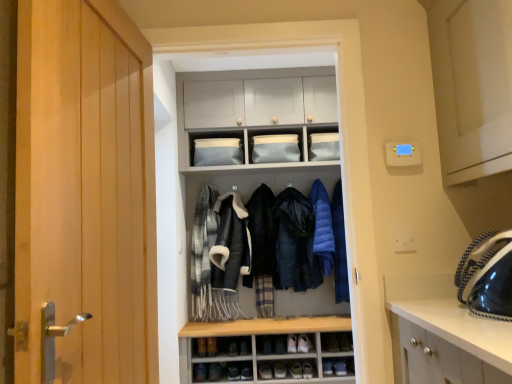
Question: Which direction should I rotate to face fluffy black jacket at center, which ranks as the fourth clothing in right-to-left order, — up or down?

Choices:
 (A) down
 (B) up

Answer: (A)

Question: Does matte blue fabric at upper center, the third cabinet when ordered from right to left, have a lesser height compared to blue down jacket at center, the 5th clothing when ordered from left to right?

Choices:
 (A) yes
 (B) no

Answer: (A)

Question: Does matte blue fabric at upper center, the 1th cabinet in the left-to-right sequence, touch blue down jacket at center, the 1th clothing from the right?

Choices:
 (A) no
 (B) yes

Answer: (A)

Question: Is matte blue fabric at upper center, the third cabinet when ordered from right to left, outside of blue down jacket at center, the 1th clothing from the right?

Choices:
 (A) yes
 (B) no

Answer: (A)

Question: Is matte blue fabric at upper center, the third cabinet when ordered from right to left, facing towards blue down jacket at center, the 1th clothing from the right?

Choices:
 (A) yes
 (B) no

Answer: (B)

Question: Would you consider matte blue fabric at upper center, the 1th cabinet in the left-to-right sequence, to be distant from blue down jacket at center, the 5th clothing when ordered from left to right?

Choices:
 (A) no
 (B) yes

Answer: (B)

Question: Is matte blue fabric at upper center, the third cabinet when ordered from right to left, surrounding blue down jacket at center, the 1th clothing from the right?

Choices:
 (A) no
 (B) yes

Answer: (A)

Question: Is white leather shoe at lower center, positioned as the 2th shoe in left-to-right order, at the left side of wooden door at left?

Choices:
 (A) yes
 (B) no

Answer: (B)

Question: Is white leather shoe at lower center, acting as the 3th shoe starting from the top, not close to wooden door at left?

Choices:
 (A) no
 (B) yes

Answer: (B)

Question: Is white leather shoe at lower center, acting as the 3th shoe starting from the top, positioned in front of wooden door at left?

Choices:
 (A) yes
 (B) no

Answer: (B)

Question: Considering the relative sizes of white leather shoe at lower center, which is counted as the 1th shoe, starting from the bottom, and wooden door at left in the image provided, is white leather shoe at lower center, which is counted as the 1th shoe, starting from the bottom, bigger than wooden door at left?

Choices:
 (A) no
 (B) yes

Answer: (A)

Question: Is wooden door at left surrounded by white leather shoe at lower center, positioned as the 2th shoe in left-to-right order?

Choices:
 (A) no
 (B) yes

Answer: (A)

Question: From the image's perspective, is white leather shoe at lower center, positioned as the 2th shoe in left-to-right order, located above wooden door at left?

Choices:
 (A) no
 (B) yes

Answer: (A)

Question: Is plaid wool scarf at center, which is the 5th clothing from right to left, far from leather shoe at lower center, acting as the second shoe starting from the bottom?

Choices:
 (A) no
 (B) yes

Answer: (A)